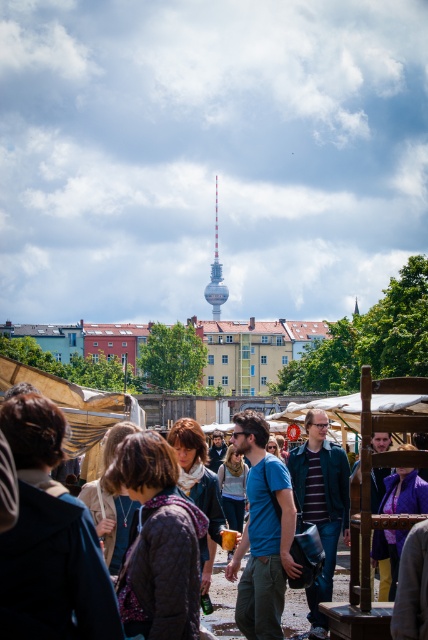
You are a photographer standing at the edge of the crowd. You want to take a photo of the metallic silver tower at center without the blue denim jacket at center blocking the view. Is the jacket likely to block the tower in your photo?

The blue denim jacket at center is not as tall as the metallic silver tower at center, so the jacket is shorter than the tower. Therefore, the jacket might block the base of the tower but not the entire structure, depending on their horizontal distance. However, since the jacket is shorter, the upper part of the tower should remain visible.

You are a photographer trying to capture a clear shot of the metallic silver tower at center without the blue denim jacket at center blocking it. Based on their sizes, is this possible?

The blue denim jacket at center might be wider than metallic silver tower at center, so there is a possibility that the jacket could block the view of the tower. To ensure a clear shot, reposition yourself to avoid the jacket.